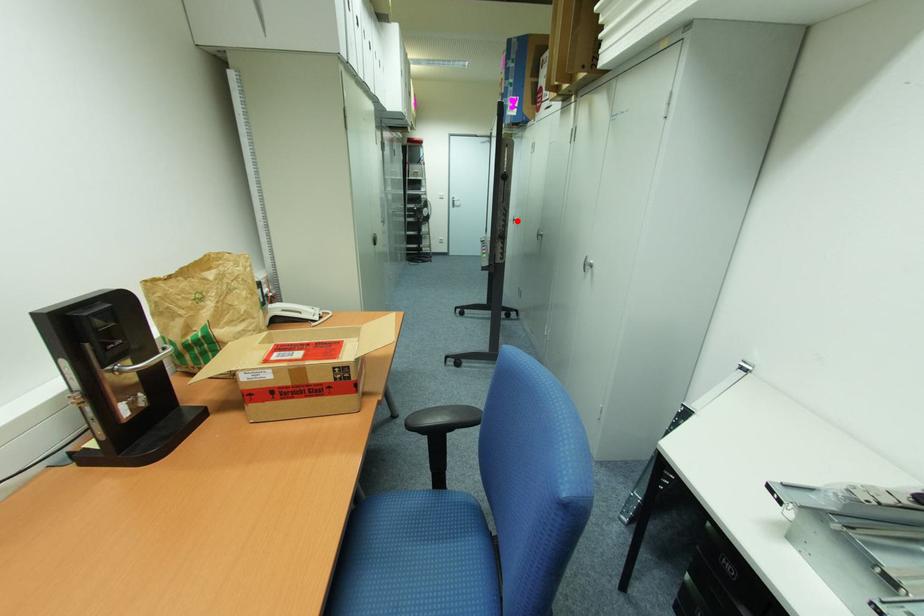
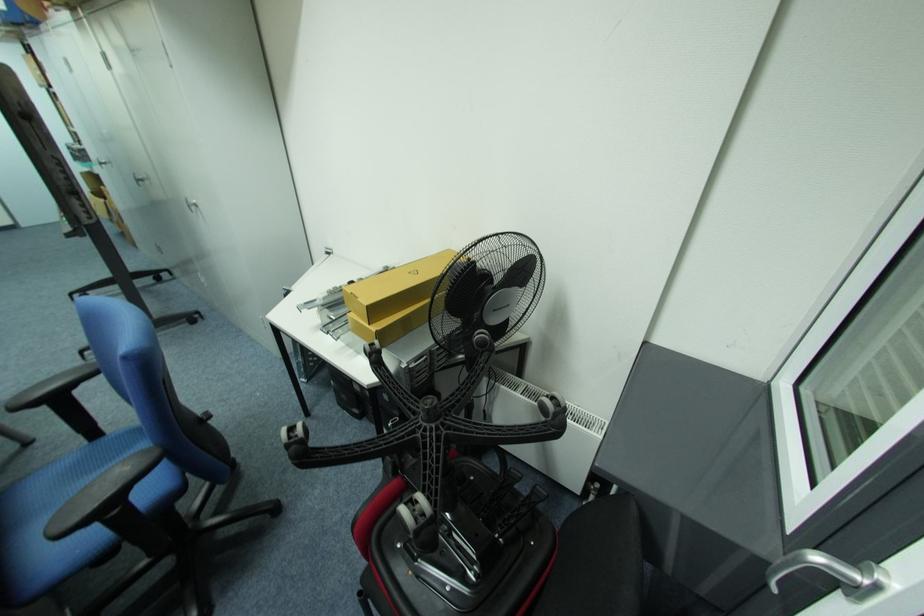
Question: A red point is marked in image1. In image2, is the corresponding 3D point closer to the camera or farther? Reply with the corresponding letter.

Choices:
 (A) The corresponding 3D point is closer.
 (B) The corresponding 3D point is farther.

Answer: (B)